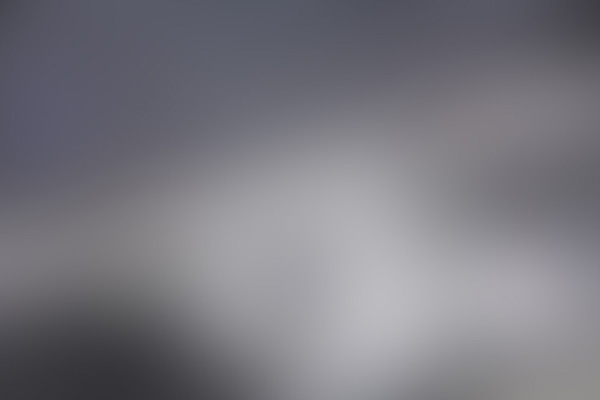
In order to click on grey screen in this screenshot , I will do `click(273, 130)`.